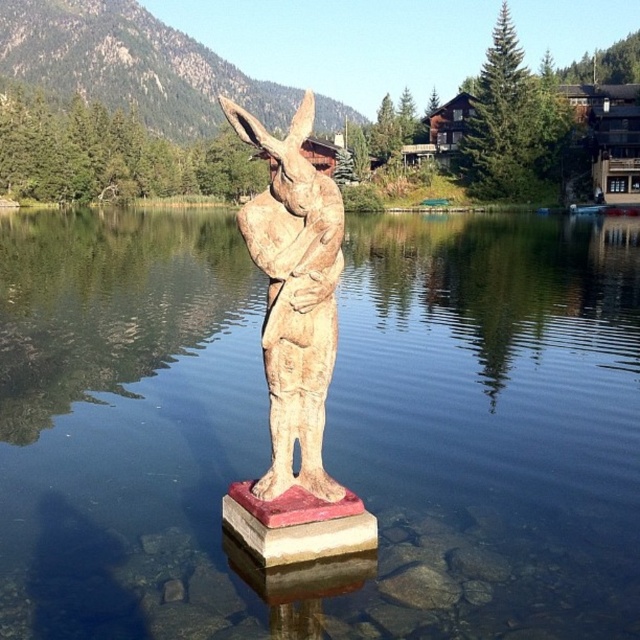
Measure the distance from clear water at statue center to wooden statue at center.

They are 22.53 meters apart.

Describe the element at coordinates (324, 426) in the screenshot. I see `clear water at statue center` at that location.

Which is in front, point (168, 611) or point (292, 248)?

Point (168, 611) is in front.

In order to click on clear water at statue center in this screenshot , I will do `click(324, 426)`.